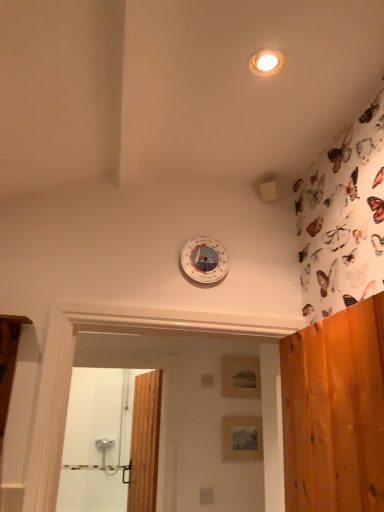
Question: Does wooden door at center have a larger size compared to white plastic clock at upper center?

Choices:
 (A) yes
 (B) no

Answer: (A)

Question: Is wooden door at center facing towards white plastic clock at upper center?

Choices:
 (A) yes
 (B) no

Answer: (B)

Question: Is wooden door at center to the left of white plastic clock at upper center from the viewer's perspective?

Choices:
 (A) yes
 (B) no

Answer: (A)

Question: Is wooden door at center turned away from white plastic clock at upper center?

Choices:
 (A) yes
 (B) no

Answer: (B)

Question: Can you confirm if wooden door at center is wider than white plastic clock at upper center?

Choices:
 (A) yes
 (B) no

Answer: (A)

Question: From their relative heights in the image, would you say wooden screen door at lower left is taller or shorter than matte wooden panel at center, which is the 2th panel from bottom to top?

Choices:
 (A) tall
 (B) short

Answer: (A)

Question: Based on their positions, is wooden screen door at lower left located to the left or right of matte wooden panel at center, the 1th panel when ordered from top to bottom?

Choices:
 (A) right
 (B) left

Answer: (B)

Question: From the image's perspective, relative to matte wooden panel at center, acting as the first panel starting from the back, is wooden screen door at lower left above or below?

Choices:
 (A) above
 (B) below

Answer: (B)

Question: In the image, is wooden screen door at lower left positioned in front of or behind matte wooden panel at center, which is the second panel from front to back?

Choices:
 (A) front
 (B) behind

Answer: (A)

Question: In terms of width, does wooden screen door at lower left look wider or thinner when compared to matte wooden panel at center, the second panel from the top?

Choices:
 (A) thin
 (B) wide

Answer: (B)

Question: From a real-world perspective, relative to matte wooden panel at center, the second panel from the top, is wooden screen door at lower left vertically above or below?

Choices:
 (A) below
 (B) above

Answer: (B)

Question: Considering their positions, is wooden screen door at lower left located in front of or behind matte wooden panel at center, placed as the first panel when sorted from front to back?

Choices:
 (A) front
 (B) behind

Answer: (A)

Question: Does point (99, 458) appear closer or farther from the camera than point (221, 417)?

Choices:
 (A) farther
 (B) closer

Answer: (A)

Question: Does point (258, 434) appear closer or farther from the camera than point (158, 411)?

Choices:
 (A) closer
 (B) farther

Answer: (A)

Question: Looking at their shapes, would you say matte wooden panel at center, the first panel when ordered from bottom to top, is wider or thinner than wooden door at center?

Choices:
 (A) thin
 (B) wide

Answer: (A)